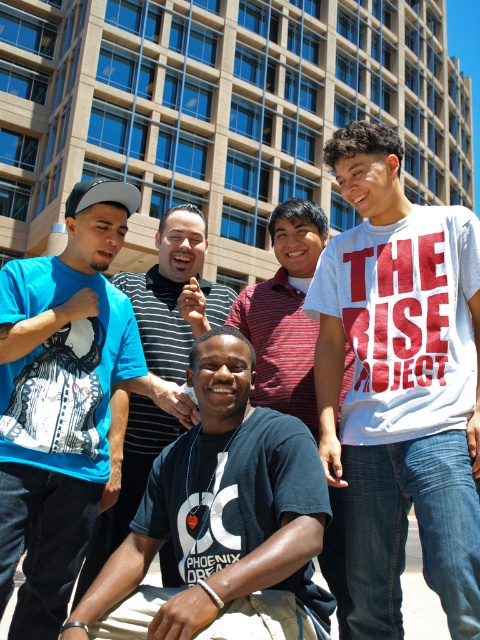
Question: Which is farther from the matte black t-shirt at left?

Choices:
 (A) white cotton t-shirt at right
 (B) matte blue t-shirt at left

Answer: (A)

Question: Among these objects, which one is farthest from the camera?

Choices:
 (A) white cotton t-shirt at right
 (B) white cotton shirt at upper right
 (C) matte blue t-shirt at left
 (D) black cotton t-shirt at center

Answer: (C)

Question: Is matte blue t-shirt at left above matte black t-shirt at left?

Choices:
 (A) no
 (B) yes

Answer: (B)

Question: Does white cotton t-shirt at right appear under white cotton shirt at upper right?

Choices:
 (A) no
 (B) yes

Answer: (A)

Question: Which point is closer to the camera?

Choices:
 (A) black cotton t-shirt at center
 (B) white cotton shirt at upper right
 (C) matte black t-shirt at left
 (D) white cotton t-shirt at right

Answer: (A)

Question: Can you confirm if white cotton t-shirt at right is positioned to the right of matte black t-shirt at left?

Choices:
 (A) yes
 (B) no

Answer: (A)